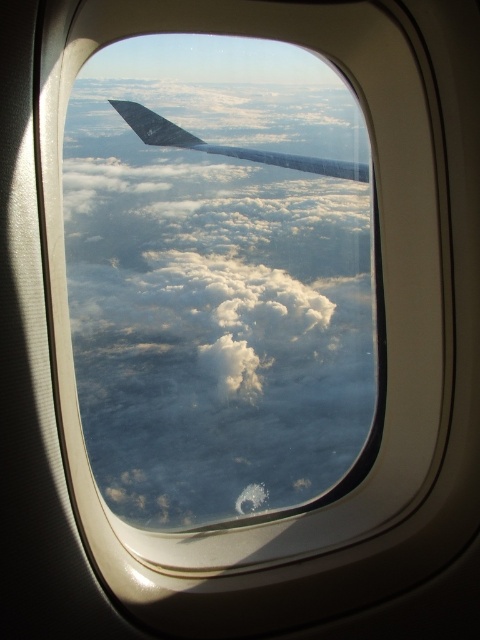
You are sitting in an airplane seat and looking out the window. You see a white fluffy cloud at center and a metallic gray wing at upper center. Which object is closer to you?

The white fluffy cloud at center is closer to the viewer than the metallic gray wing at upper center.

You are a passenger sitting by the window in an airplane. You notice a white fluffy cloud at center and a metallic gray wing at upper center. Which object is closer to the airplane you are in?

The metallic gray wing at upper center is part of the airplane itself, so it is closer to you than the white fluffy cloud at center which is outside the aircraft.

You are a pilot checking the position of the white fluffy cloud at center relative to the airplane. Based on the coordinates provided, is the cloud positioned to the left or right of the airplane?

The white fluffy cloud at center is located at point 0.431 on the x and 0.454 on the y axis. Since the airplane is positioned at the center of the image, the cloud is slightly to the left of the airplane.